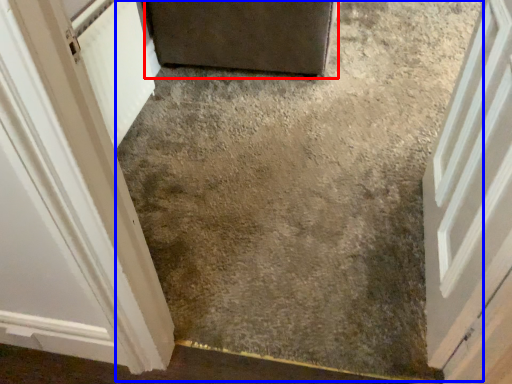
Question: Among these objects, which one is nearest to the camera, door (highlighted by a red box) or concrete (highlighted by a blue box)?

Choices:
 (A) door
 (B) concrete

Answer: (B)